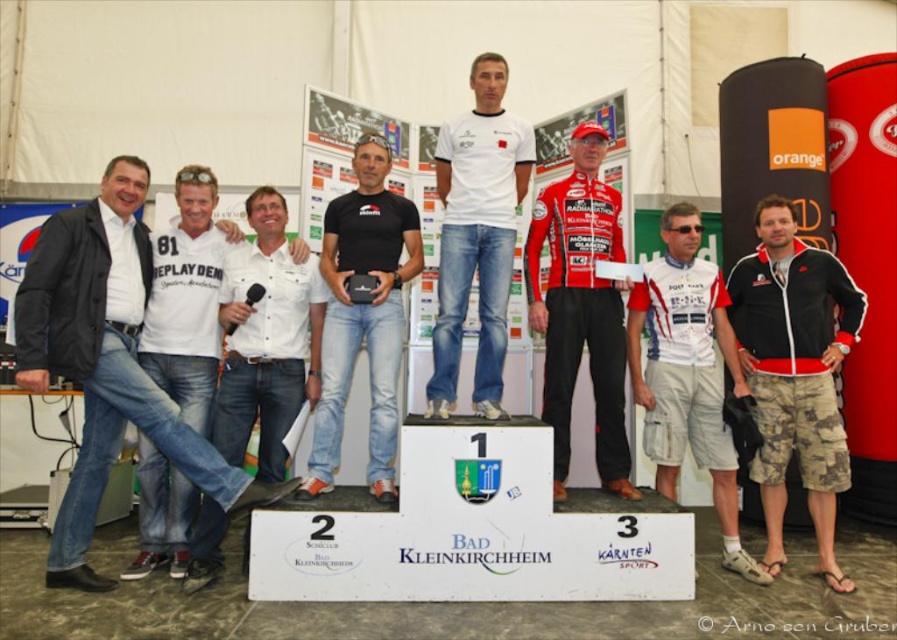
Between black/red zip-up jacket at right and white cotton shirt at left, which one has less height?

white cotton shirt at left

Who is taller, black/red zip-up jacket at right or white cotton shirt at left?

With more height is black/red zip-up jacket at right.

You are a GUI agent. You are given a task and a screenshot of the screen. Output one action in this format:
    pyautogui.click(x=<x>, y=<y>)
    Task: Click on the black/red zip-up jacket at right
    The image size is (897, 640).
    Given the screenshot: What is the action you would take?
    pyautogui.click(x=795, y=372)

Is white jersey at center below black matte jeans at center?

Yes.

In the scene shown: Is white jersey at center positioned at the back of black matte jeans at center?

Yes, white jersey at center is further from the viewer.

Image resolution: width=897 pixels, height=640 pixels. Find the location of `white jersey at center`. white jersey at center is located at coordinates (688, 372).

The image size is (897, 640). Find the location of `white jersey at center`. white jersey at center is located at coordinates 688,372.

Which of these two, denim jeans at left or white cotton t-shirt at center, stands taller?

Standing taller between the two is denim jeans at left.

Can you confirm if denim jeans at left is positioned to the right of white cotton t-shirt at center?

In fact, denim jeans at left is to the left of white cotton t-shirt at center.

Locate an element on the screen. The width and height of the screenshot is (897, 640). denim jeans at left is located at coordinates (102, 356).